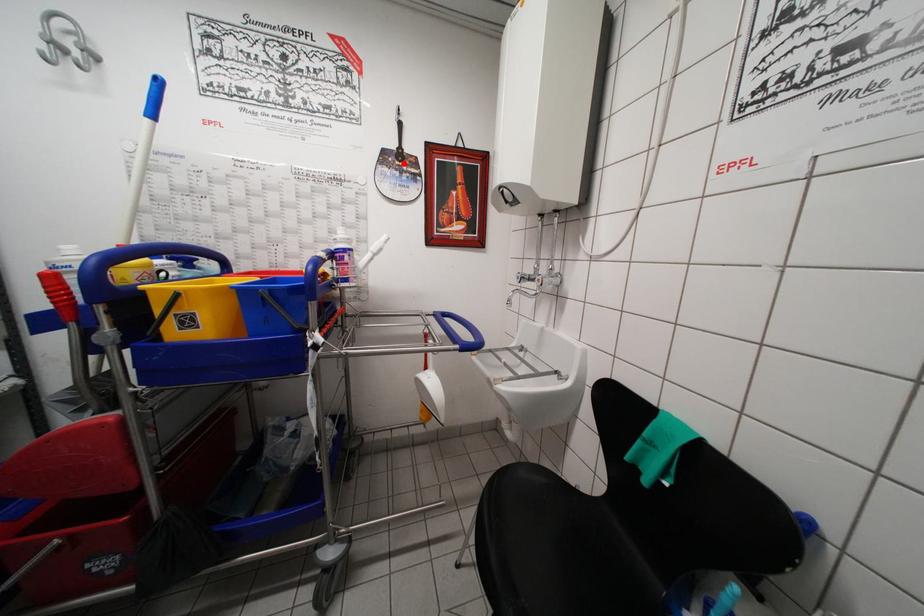
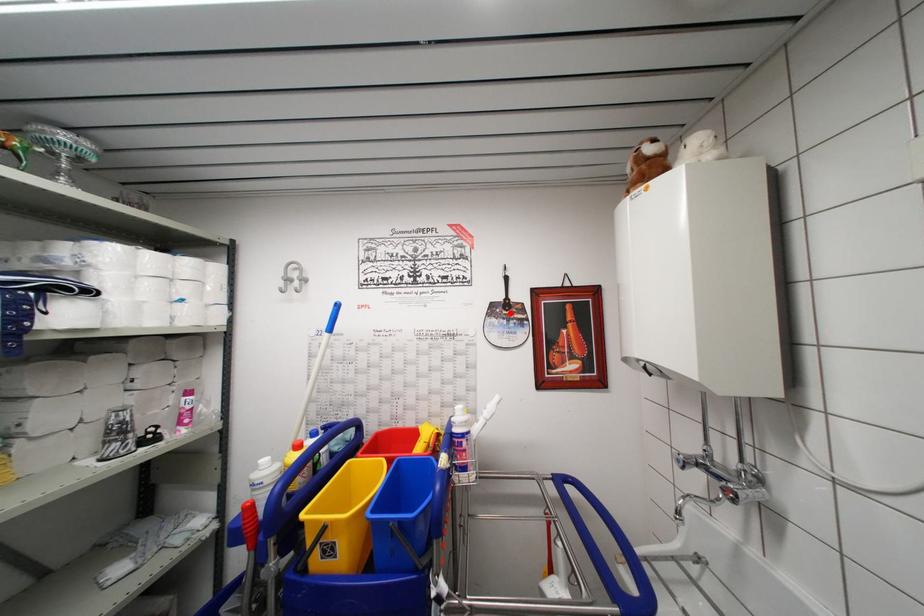
I am providing you with two images of the same scene from different viewpoints. A red point is marked on the first image and another point is marked on the second image. Does the point marked in image1 correspond to the same location as the one in image2?

Yes